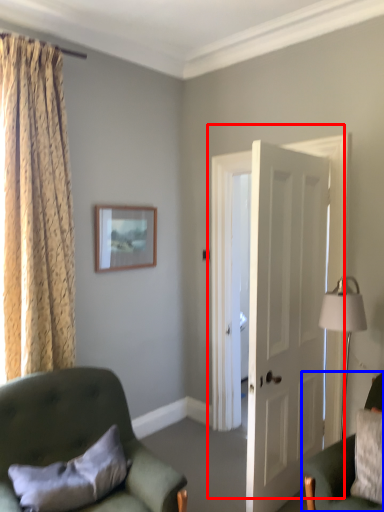
Question: Which of the following is the farthest to the observer, door (highlighted by a red box) or chair (highlighted by a blue box)?

Choices:
 (A) door
 (B) chair

Answer: (A)